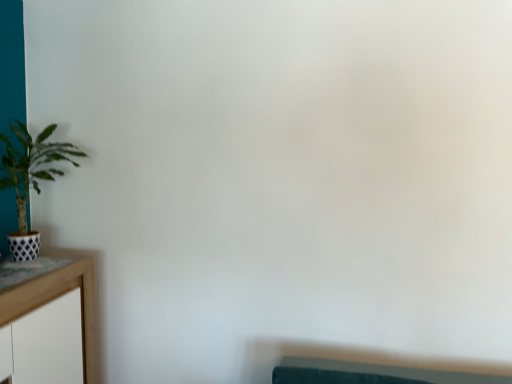
I want to click on green matte plant at left, so click(x=31, y=166).

Based on the photo, in order to face green matte plant at left, should I rotate leftwards or rightwards?

It's best to rotate left around 27.475 degrees.

What do you see at coordinates (31, 166) in the screenshot? I see `green matte plant at left` at bounding box center [31, 166].

This screenshot has height=384, width=512. What do you see at coordinates (55, 298) in the screenshot?
I see `wooden table at left` at bounding box center [55, 298].

This screenshot has width=512, height=384. In order to click on wooden table at left in this screenshot , I will do `click(55, 298)`.

This screenshot has width=512, height=384. I want to click on green matte plant at left, so click(31, 166).

In the scene shown: Which object is positioned more to the right, wooden table at left or green matte plant at left?

green matte plant at left is more to the right.

Does wooden table at left lie behind green matte plant at left?

No, wooden table at left is closer to the camera.

Considering the points (55, 293) and (54, 152), which point is in front, point (55, 293) or point (54, 152)?

The point (55, 293) is more forward.

From the image's perspective, relative to green matte plant at left, is wooden table at left above or below?

From the image's perspective, wooden table at left appears below green matte plant at left.

From a real-world perspective, is wooden table at left above or below green matte plant at left?

Clearly, from a real-world perspective, wooden table at left is below green matte plant at left.

Is wooden table at left wider than green matte plant at left?

Yes.

Can you confirm if wooden table at left is taller than green matte plant at left?

Indeed, wooden table at left has a greater height compared to green matte plant at left.

Between wooden table at left and green matte plant at left, which one has smaller size?

With smaller size is green matte plant at left.

Which is correct: wooden table at left is inside green matte plant at left, or outside of it?

wooden table at left exists outside the volume of green matte plant at left.

Is wooden table at left touching green matte plant at left?

No, wooden table at left is not next to green matte plant at left.

Is wooden table at left oriented away from green matte plant at left?

wooden table at left does not have its back to green matte plant at left.

How different are the orientations of wooden table at left and green matte plant at left in degrees?

2.51 degrees separate the facing orientations of wooden table at left and green matte plant at left.

How distant is wooden table at left from green matte plant at left?

wooden table at left is 18.00 inches away from green matte plant at left.

Locate an element on the screen. The height and width of the screenshot is (384, 512). table located below the green matte plant at left (from the image's perspective) is located at coordinates (55, 298).

Considering the relative positions of green matte plant at left and wooden table at left in the image provided, is green matte plant at left to the left or to the right of wooden table at left?

Based on their positions, green matte plant at left is located to the right of wooden table at left.

Is green matte plant at left in front of or behind wooden table at left in the image?

Clearly, green matte plant at left is behind wooden table at left.

Which is nearer, (11, 169) or (57, 294)?

The point (57, 294) is more forward.

From the image's perspective, which one is positioned higher, green matte plant at left or wooden table at left?

green matte plant at left, from the image's perspective.

From a real-world perspective, who is located higher, green matte plant at left or wooden table at left?

green matte plant at left is physically above.

Which object is thinner, green matte plant at left or wooden table at left?

green matte plant at left.

Is green matte plant at left shorter than wooden table at left?

Yes.

Considering the sizes of green matte plant at left and wooden table at left in the image, is green matte plant at left bigger or smaller than wooden table at left?

Clearly, green matte plant at left is smaller in size than wooden table at left.

Is wooden table at left a part of green matte plant at left?

No, wooden table at left is not a part of green matte plant at left.

Is green matte plant at left placed right next to wooden table at left?

No, green matte plant at left is not with wooden table at left.

Could you tell me if green matte plant at left is turned towards wooden table at left?

No, green matte plant at left does not turn towards wooden table at left.

This screenshot has width=512, height=384. Find the location of `table in front of the green matte plant at left`. table in front of the green matte plant at left is located at coordinates (55, 298).

The image size is (512, 384). Identify the location of houseplant that is behind the wooden table at left. (31, 166).

The height and width of the screenshot is (384, 512). What are the coordinates of `houseplant to the right of wooden table at left` in the screenshot? It's located at (31, 166).